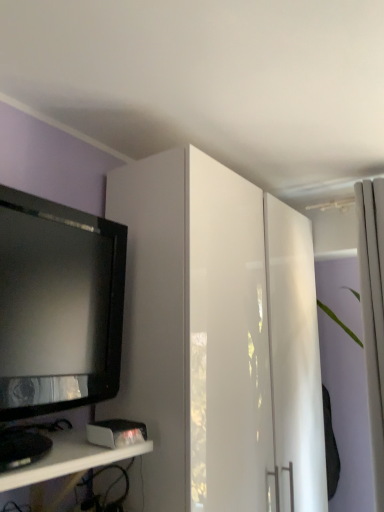
What do you see at coordinates (372, 326) in the screenshot?
I see `white fabric curtain at right` at bounding box center [372, 326].

This screenshot has width=384, height=512. What are the coordinates of `white glossy shelf at lower left` in the screenshot? It's located at (69, 459).

I want to click on white glossy cabinet at upper center, so click(x=195, y=329).

I want to click on white fabric curtain at right, so click(x=372, y=326).

Could you tell me if white fabric curtain at right is turned towards white glossy shelf at lower left?

No, white fabric curtain at right is not turned towards white glossy shelf at lower left.

Would you consider white fabric curtain at right to be distant from white glossy shelf at lower left?

Indeed, white fabric curtain at right is not near white glossy shelf at lower left.

Does white fabric curtain at right lie behind white glossy shelf at lower left?

Yes, white fabric curtain at right is behind white glossy shelf at lower left.

Is white fabric curtain at right positioned beyond the bounds of white glossy cabinet at upper center?

That's correct, white fabric curtain at right is outside of white glossy cabinet at upper center.

Are white fabric curtain at right and white glossy cabinet at upper center far apart?

No.

How different are the orientations of white fabric curtain at right and white glossy cabinet at upper center in degrees?

white fabric curtain at right and white glossy cabinet at upper center are facing 90 degrees away from each other.

Identify the location of cabinetry below the white fabric curtain at right (from the image's perspective). The width and height of the screenshot is (384, 512). (195, 329).

Considering the sizes of objects white glossy shelf at lower left and white glossy cabinet at upper center in the image provided, who is shorter, white glossy shelf at lower left or white glossy cabinet at upper center?

Standing shorter between the two is white glossy shelf at lower left.

Does white glossy shelf at lower left appear on the left side of white glossy cabinet at upper center?

Yes, white glossy shelf at lower left is to the left of white glossy cabinet at upper center.

At what (x,y) coordinates should I click in order to perform the action: click on shelf below the white glossy cabinet at upper center (from a real-world perspective). Please return your answer as a coordinate pair (x, y). The width and height of the screenshot is (384, 512). Looking at the image, I should click on (69, 459).

Considering the relative sizes of white glossy cabinet at upper center and white glossy shelf at lower left in the image provided, is white glossy cabinet at upper center shorter than white glossy shelf at lower left?

No.

Looking at this image, is white glossy cabinet at upper center thinner than white glossy shelf at lower left?

No, white glossy cabinet at upper center is not thinner than white glossy shelf at lower left.

Is white glossy cabinet at upper center spatially inside white glossy shelf at lower left, or outside of it?

white glossy cabinet at upper center is outside white glossy shelf at lower left.

In the image, is white glossy cabinet at upper center on the left side or the right side of white glossy shelf at lower left?

In the image, white glossy cabinet at upper center appears on the right side of white glossy shelf at lower left.

Is black glossy television at left surrounded by white fabric curtain at right?

No, black glossy television at left is located outside of white fabric curtain at right.

Considering the positions of objects white fabric curtain at right and black glossy television at left in the image provided, who is more to the left, white fabric curtain at right or black glossy television at left?

black glossy television at left is more to the left.

From a real-world perspective, is white fabric curtain at right positioned over black glossy television at left based on gravity?

Yes, from a real-world perspective, white fabric curtain at right is over black glossy television at left

Which of these two, white glossy cabinet at upper center or black glossy television at left, is wider?

Wider between the two is white glossy cabinet at upper center.

Find the location of a particular element. The width and height of the screenshot is (384, 512). television located above the white glossy cabinet at upper center (from a real-world perspective) is located at coordinates click(58, 306).

Considering the relative positions of white glossy cabinet at upper center and black glossy television at left in the image provided, is white glossy cabinet at upper center in front of black glossy television at left?

No, it is not.

Which of these two, white glossy cabinet at upper center or black glossy television at left, stands shorter?

Standing shorter between the two is black glossy television at left.

Where is `curtain that is above the white glossy cabinet at upper center (from the image's perspective)`? curtain that is above the white glossy cabinet at upper center (from the image's perspective) is located at coordinates (372, 326).

Which is more to the right, white glossy cabinet at upper center or white fabric curtain at right?

Positioned to the right is white fabric curtain at right.

Considering the sizes of objects white glossy cabinet at upper center and white fabric curtain at right in the image provided, who is taller, white glossy cabinet at upper center or white fabric curtain at right?

Standing taller between the two is white glossy cabinet at upper center.

Based on the photo, from the image's perspective, is white glossy cabinet at upper center positioned above or below white fabric curtain at right?

Based on their image positions, white glossy cabinet at upper center is located beneath white fabric curtain at right.

The image size is (384, 512). In the image, there is a white glossy shelf at lower left. Identify the location of curtain above it (from the image's perspective). (372, 326).

You are a GUI agent. You are given a task and a screenshot of the screen. Output one action in this format:
    pyautogui.click(x=<x>, y=<y>)
    Task: Click on the cabinetry located on the left of white fabric curtain at right
    The width and height of the screenshot is (384, 512).
    Given the screenshot: What is the action you would take?
    pyautogui.click(x=195, y=329)

Looking at the image, which one is located further to white fabric curtain at right, white glossy cabinet at upper center or black glossy television at left?

Among the two, black glossy television at left is located further to white fabric curtain at right.

Based on their spatial positions, is white glossy cabinet at upper center or black glossy television at left further from white glossy shelf at lower left?

white glossy cabinet at upper center is positioned further to the anchor white glossy shelf at lower left.

From the image, which object appears to be nearer to white glossy shelf at lower left, black glossy television at left or white glossy cabinet at upper center?

black glossy television at left lies closer to white glossy shelf at lower left than the other object.

Which object lies further to the anchor point white glossy cabinet at upper center, black glossy television at left or white fabric curtain at right?

The object further to white glossy cabinet at upper center is white fabric curtain at right.

From the image, which object appears to be farther from white glossy cabinet at upper center, white glossy shelf at lower left or white fabric curtain at right?

The object further to white glossy cabinet at upper center is white fabric curtain at right.

From the image, which object appears to be nearer to white fabric curtain at right, white glossy cabinet at upper center or white glossy shelf at lower left?

white glossy cabinet at upper center.

Looking at this image, based on their spatial positions, is white fabric curtain at right or white glossy cabinet at upper center further from white glossy shelf at lower left?

white fabric curtain at right lies further to white glossy shelf at lower left than the other object.

Estimate the real-world distances between objects in this image. Which object is closer to white glossy cabinet at upper center, white fabric curtain at right or black glossy television at left?

Based on the image, black glossy television at left appears to be nearer to white glossy cabinet at upper center.

Locate an element on the screen. The height and width of the screenshot is (512, 384). television between white glossy shelf at lower left and white fabric curtain at right is located at coordinates (58, 306).

Where is `cabinetry between black glossy television at left and white fabric curtain at right`? cabinetry between black glossy television at left and white fabric curtain at right is located at coordinates (195, 329).

Locate an element on the screen. This screenshot has width=384, height=512. cabinetry located between white glossy shelf at lower left and white fabric curtain at right in the left-right direction is located at coordinates (195, 329).

Where is `television located between white glossy shelf at lower left and white glossy cabinet at upper center in the left-right direction`? This screenshot has width=384, height=512. television located between white glossy shelf at lower left and white glossy cabinet at upper center in the left-right direction is located at coordinates (58, 306).